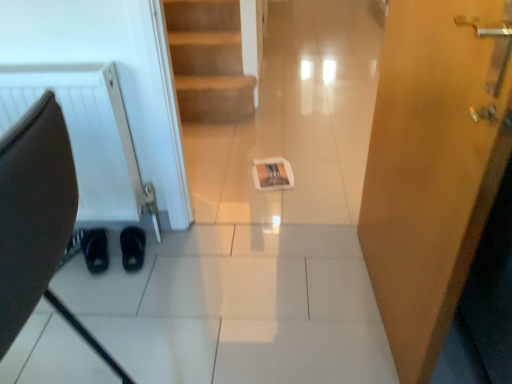
Where is `vacant area that lies to the right of black suede shoes at lower left, the first footwear from the left`? The width and height of the screenshot is (512, 384). vacant area that lies to the right of black suede shoes at lower left, the first footwear from the left is located at coordinates (146, 249).